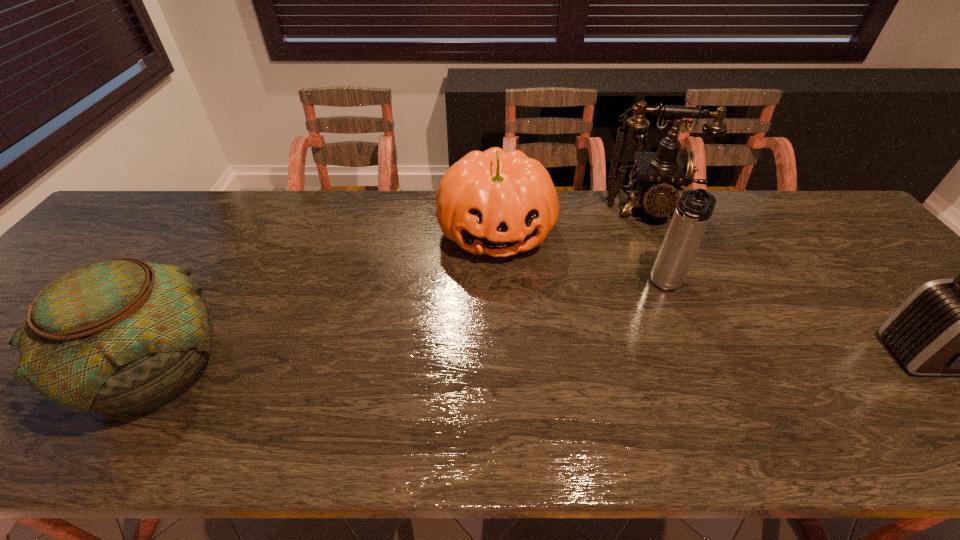
Identify the location of free space at the far left corner of the desktop. click(x=140, y=233).

Identify the location of free space at the far right corner. The width and height of the screenshot is (960, 540). tap(822, 201).

Find the location of `vacant space in between the tallest object and the thermos bottle`. vacant space in between the tallest object and the thermos bottle is located at coordinates (656, 247).

Where is `vacant space that's between the thermos bottle and the pottery`? This screenshot has height=540, width=960. vacant space that's between the thermos bottle and the pottery is located at coordinates (411, 327).

Where is `blank region between the leftmost object and the thermos bottle`? This screenshot has width=960, height=540. blank region between the leftmost object and the thermos bottle is located at coordinates (411, 327).

Where is `vacant area between the pottery and the thermos bottle`? The width and height of the screenshot is (960, 540). vacant area between the pottery and the thermos bottle is located at coordinates (x=411, y=327).

Where is `vacant space in between the thermos bottle and the pottery`? Image resolution: width=960 pixels, height=540 pixels. vacant space in between the thermos bottle and the pottery is located at coordinates (411, 327).

Locate an element on the screen. Image resolution: width=960 pixels, height=540 pixels. object that is the closest one to the camcorder is located at coordinates (693, 212).

Identify which object is the closest to the pottery. Please provide its 2D coordinates. Your answer should be formatted as a tuple, i.e. [(x, y)], where the tuple contains the x and y coordinates of a point satisfying the conditions above.

[(499, 203)]

Find the location of a particular element. The image size is (960, 540). free spot that satisfies the following two spatial constraints: 1. on the back side of the telephone; 2. on the left side of the fourth object from right to left is located at coordinates (495, 208).